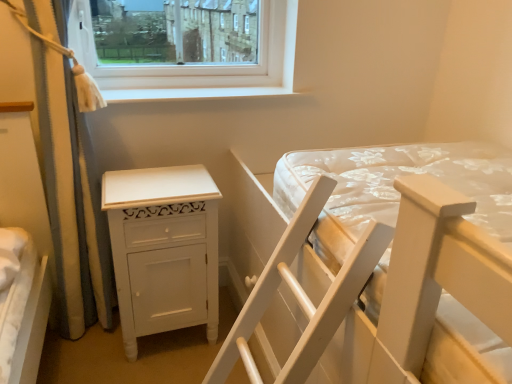
Question: Is white wooden bed at center looking in the opposite direction of white smooth window sill at upper center?

Choices:
 (A) yes
 (B) no

Answer: (B)

Question: From the image's perspective, would you say white wooden bed at center is shown under white smooth window sill at upper center?

Choices:
 (A) yes
 (B) no

Answer: (A)

Question: Considering the relative positions of white wooden bed at center and white smooth window sill at upper center in the image provided, is white wooden bed at center in front of white smooth window sill at upper center?

Choices:
 (A) yes
 (B) no

Answer: (A)

Question: Considering the relative sizes of white wooden bed at center and white smooth window sill at upper center in the image provided, is white wooden bed at center thinner than white smooth window sill at upper center?

Choices:
 (A) no
 (B) yes

Answer: (A)

Question: From a real-world perspective, is white wooden bed at center physically above white smooth window sill at upper center?

Choices:
 (A) no
 (B) yes

Answer: (A)

Question: Is point (142, 216) positioned closer to the camera than point (100, 238)?

Choices:
 (A) closer
 (B) farther

Answer: (A)

Question: Looking at the image, does white painted wood nightstand at lower left seem bigger or smaller compared to white textured curtain at left?

Choices:
 (A) big
 (B) small

Answer: (B)

Question: From a real-world perspective, is white painted wood nightstand at lower left above or below white textured curtain at left?

Choices:
 (A) above
 (B) below

Answer: (B)

Question: Relative to white textured curtain at left, is white painted wood nightstand at lower left in front or behind?

Choices:
 (A) front
 (B) behind

Answer: (B)

Question: Is point (261, 94) closer or farther from the camera than point (269, 218)?

Choices:
 (A) farther
 (B) closer

Answer: (A)

Question: From a real-world perspective, relative to white wooden bed at center, is white smooth window sill at upper center vertically above or below?

Choices:
 (A) below
 (B) above

Answer: (B)

Question: From the image's perspective, is white smooth window sill at upper center above or below white wooden bed at center?

Choices:
 (A) below
 (B) above

Answer: (B)

Question: Relative to white wooden bed at center, is white smooth window sill at upper center in front or behind?

Choices:
 (A) behind
 (B) front

Answer: (A)

Question: Is point (25, 28) closer or farther from the camera than point (335, 334)?

Choices:
 (A) closer
 (B) farther

Answer: (B)

Question: Is white textured curtain at left inside the boundaries of white wooden bed at center, or outside?

Choices:
 (A) inside
 (B) outside

Answer: (B)